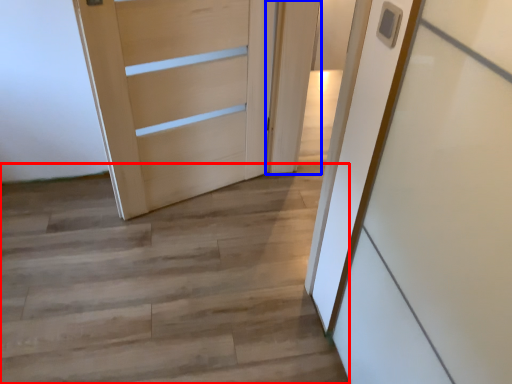
Question: Which object appears closest to the camera in this image, stairwell (highlighted by a red box) or door (highlighted by a blue box)?

Choices:
 (A) stairwell
 (B) door

Answer: (A)